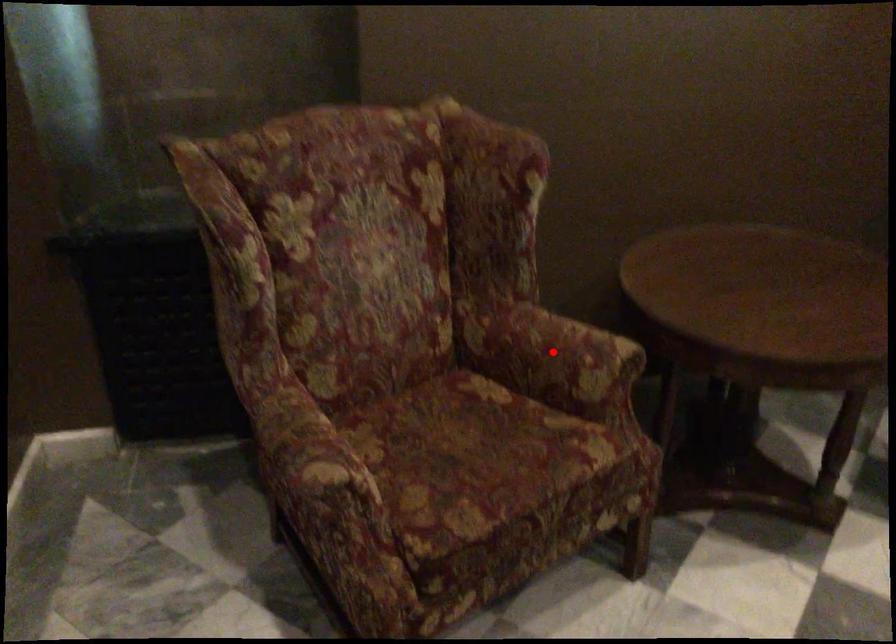
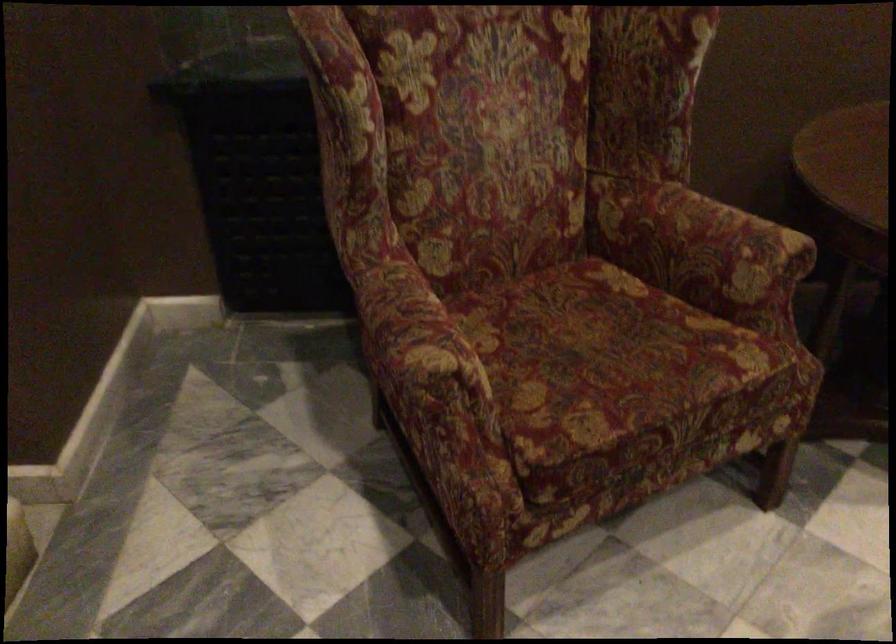
Locate, in the second image, the point that corresponds to the highlighted location in the first image.

(700, 243)